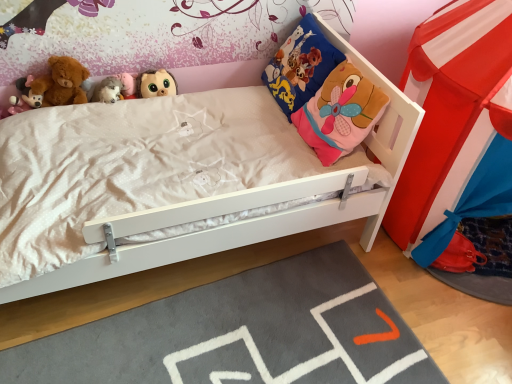
Locate an element on the screen. The image size is (512, 384). free spot above gray soft rug at lower center (from a real-world perspective) is located at coordinates (248, 339).